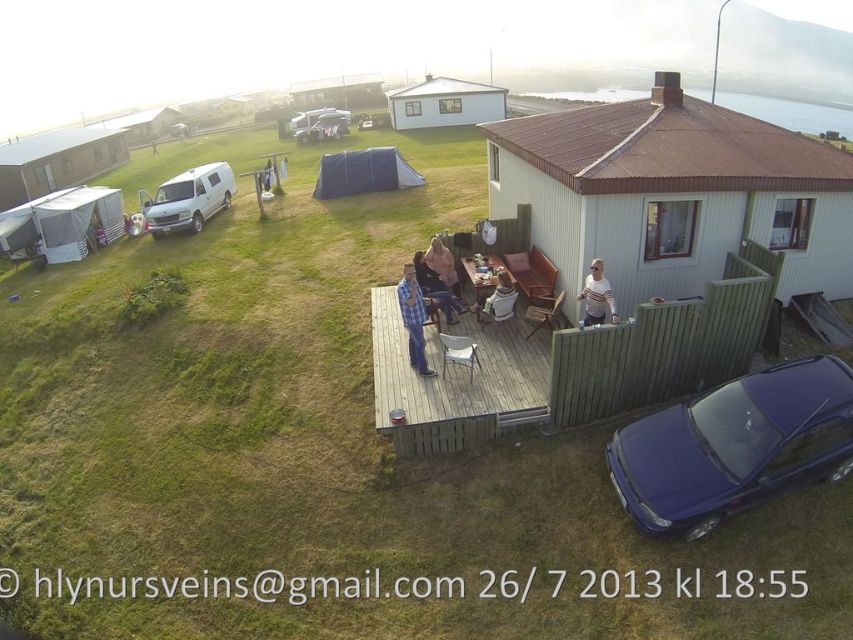
Question: Which object appears closest to the camera in this image?

Choices:
 (A) wooden deck at center
 (B) white striped shirt at upper right
 (C) wooden picnic table at center
 (D) metallic blue sedan at lower right

Answer: (D)

Question: Which of the following is the farthest from the observer?

Choices:
 (A) (479, 276)
 (B) (202, 189)

Answer: (B)

Question: Is white matte van at left bigger than matte blue shirt at center?

Choices:
 (A) no
 (B) yes

Answer: (B)

Question: Considering the relative positions of metallic blue sedan at lower right and white sweater at center in the image provided, where is metallic blue sedan at lower right located with respect to white sweater at center?

Choices:
 (A) left
 (B) right

Answer: (B)

Question: Is the position of metallic blue sedan at lower right less distant than that of matte blue shirt at center?

Choices:
 (A) no
 (B) yes

Answer: (B)

Question: Estimate the real-world distances between objects in this image. Which object is closer to the wooden picnic table at center?

Choices:
 (A) metallic blue sedan at lower right
 (B) white matte van at left

Answer: (A)